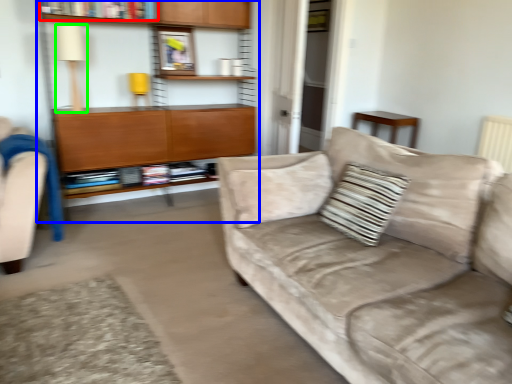
Question: Which is farther away from book (highlighted by a red box)? bookcase (highlighted by a blue box) or lamp (highlighted by a green box)?

Choices:
 (A) bookcase
 (B) lamp

Answer: (A)